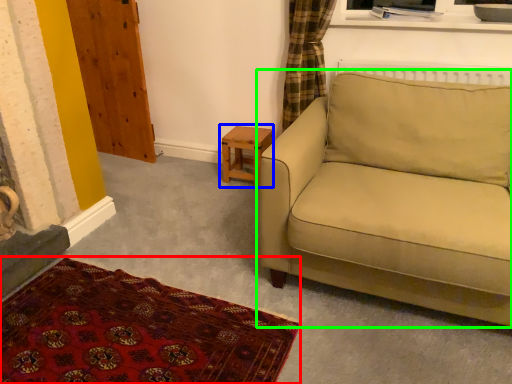
Question: Considering the real-world distances, which object is closest to plain (highlighted by a red box)? table (highlighted by a blue box) or studio couch (highlighted by a green box).

Choices:
 (A) table
 (B) studio couch

Answer: (B)